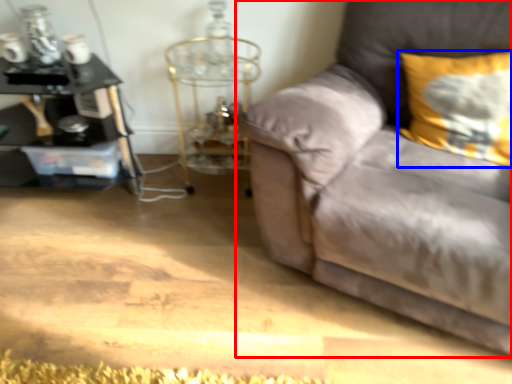
Question: Which of the following is the farthest to the observer, studio couch (highlighted by a red box) or pillow (highlighted by a blue box)?

Choices:
 (A) studio couch
 (B) pillow

Answer: (B)